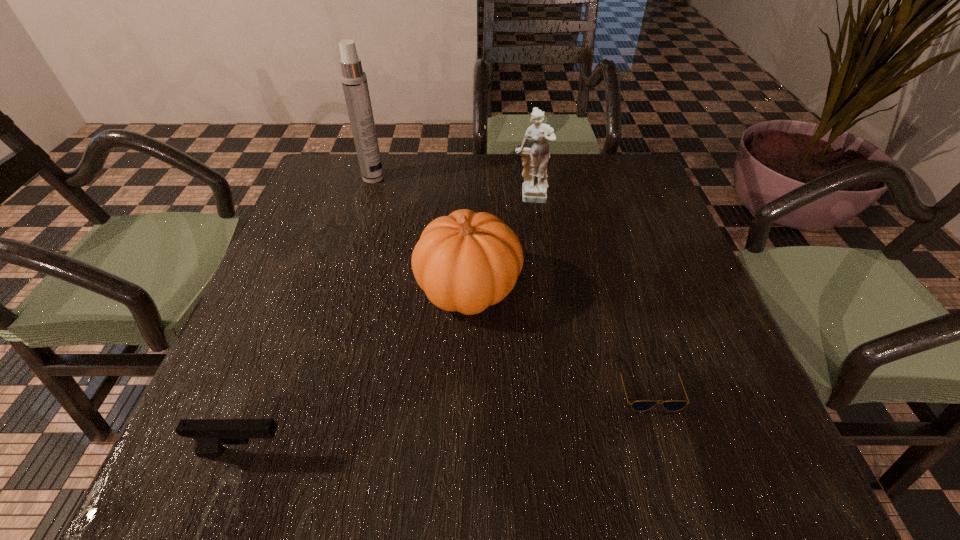
You are a GUI agent. You are given a task and a screenshot of the screen. Output one action in this format:
    pyautogui.click(x=<x>, y=<y>)
    Task: Click on the empty space between the farthest object and the nearest object
    
    Given the screenshot: What is the action you would take?
    pyautogui.click(x=309, y=315)

What are the coordinates of `free point between the shortest object and the pumpkin` in the screenshot? It's located at (558, 335).

Image resolution: width=960 pixels, height=540 pixels. What are the coordinates of `vacant area between the second shortest object and the aerosol can` in the screenshot? It's located at (309, 315).

The height and width of the screenshot is (540, 960). In order to click on free spot between the fourth nearest object and the second shortest object in this screenshot , I will do `click(388, 325)`.

Locate an element on the screen. free space between the pumpkin and the aerosol can is located at coordinates (420, 233).

The height and width of the screenshot is (540, 960). I want to click on free space that is in between the sunglasses and the nearest object, so click(446, 416).

Identify the location of free area in between the pumpkin and the aerosol can. (420, 233).

I want to click on object identified as the closest to the shortest object, so [x=466, y=261].

At what (x,y) coordinates should I click in order to perform the action: click on object that is the third closest to the tallest object. Please return your answer as a coordinate pair (x, y). This screenshot has width=960, height=540. Looking at the image, I should click on (210, 435).

Locate an element on the screen. The width and height of the screenshot is (960, 540). free location that satisfies the following two spatial constraints: 1. on the front-facing side of the second farthest object; 2. on the front-facing side of the nearest object is located at coordinates (564, 452).